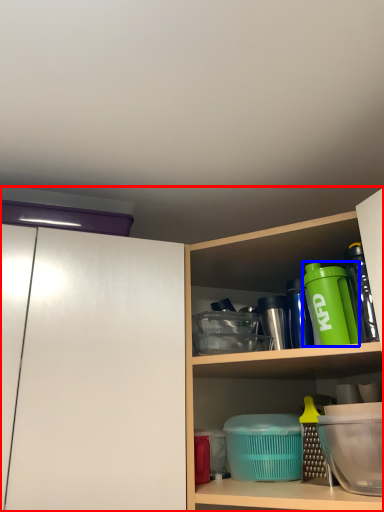
Question: Which point is closer to the camera, cabinetry (highlighted by a red box) or bottle (highlighted by a blue box)?

Choices:
 (A) cabinetry
 (B) bottle

Answer: (A)